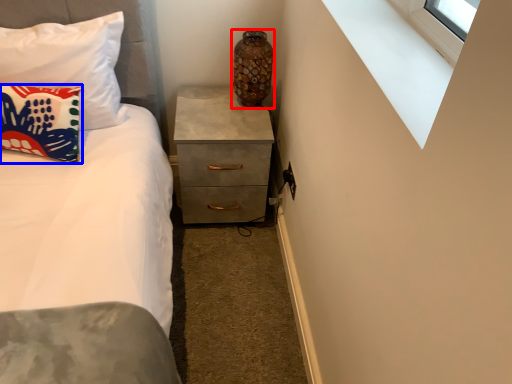
Question: Which of the following is the closest to the observer, vase (highlighted by a red box) or pillow (highlighted by a blue box)?

Choices:
 (A) vase
 (B) pillow

Answer: (B)